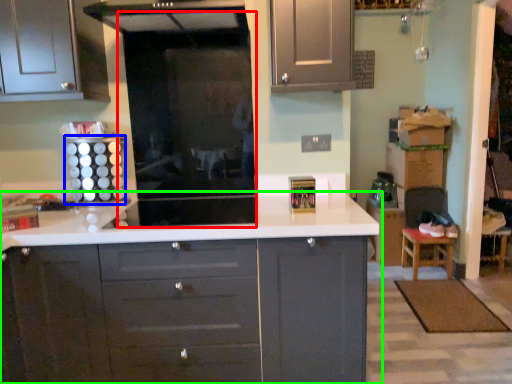
Question: Which object is positioned closest to glass door (highlighted by a red box)? Select from appliance (highlighted by a blue box) and countertop (highlighted by a green box).

Choices:
 (A) appliance
 (B) countertop

Answer: (A)